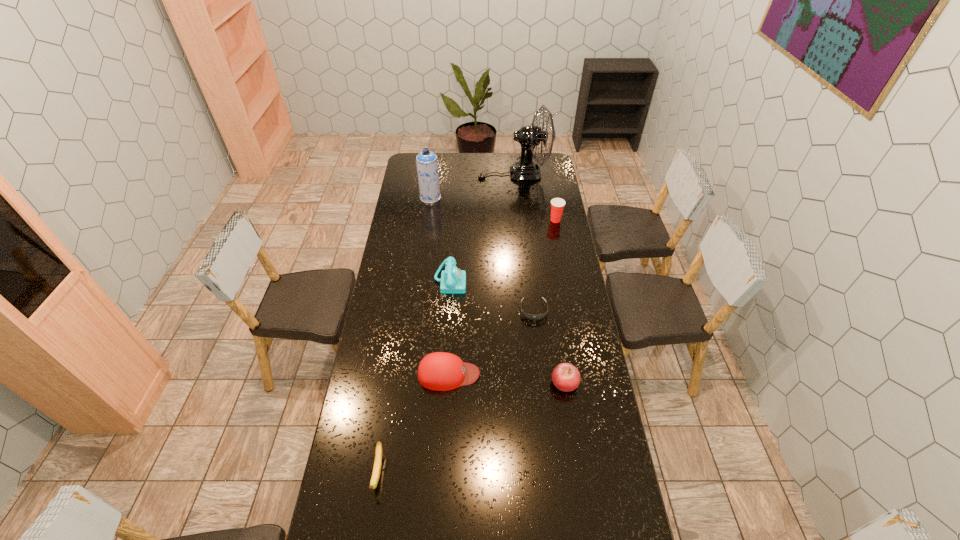
Where is `the fifth farthest object`? This screenshot has width=960, height=540. the fifth farthest object is located at coordinates 529,316.

Identify the location of goggles. (529, 316).

Find the location of a particular element. The image size is (960, 540). free space located 0.210m in front of the tallest object, indicating the direction of air flow is located at coordinates (443, 174).

At what (x,y) coordinates should I click in order to perform the action: click on vacant space located in front of the tallest object, indicating the direction of air flow. Please return your answer as a coordinate pair (x, y). The image size is (960, 540). Looking at the image, I should click on (467, 174).

The height and width of the screenshot is (540, 960). What are the coordinates of `blank space located 0.200m in front of the tallest object, indicating the direction of air flow` in the screenshot? It's located at (444, 174).

Where is `vacant space located on the back of the seventh shortest object`? This screenshot has width=960, height=540. vacant space located on the back of the seventh shortest object is located at coordinates (434, 167).

Identify the location of free point located 0.370m on the dial of the fifth nearest object. This screenshot has width=960, height=540. (548, 281).

Where is `vacant area situated on the front of the Dixie cup`? vacant area situated on the front of the Dixie cup is located at coordinates (563, 259).

What are the coordinates of `free point located 0.120m on the front-facing side of the baseball cap` in the screenshot? It's located at (512, 374).

Image resolution: width=960 pixels, height=540 pixels. Find the location of `vacant area located on the front of the apple`. vacant area located on the front of the apple is located at coordinates (568, 408).